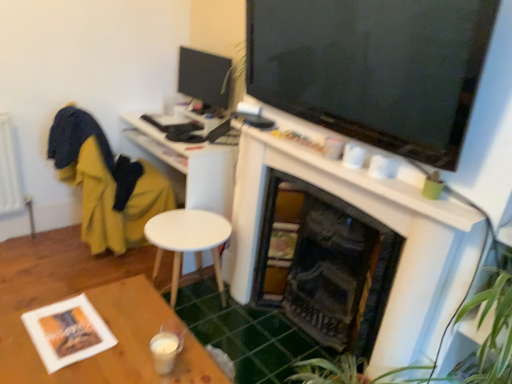
Question: Is wooden table at lower left thinner than white matte fireplace at upper center?

Choices:
 (A) no
 (B) yes

Answer: (A)

Question: Is there a large distance between wooden table at lower left and white matte fireplace at upper center?

Choices:
 (A) yes
 (B) no

Answer: (B)

Question: Is wooden table at lower left facing away from white matte fireplace at upper center?

Choices:
 (A) yes
 (B) no

Answer: (B)

Question: Can you confirm if wooden table at lower left is wider than white matte fireplace at upper center?

Choices:
 (A) no
 (B) yes

Answer: (B)

Question: From the image's perspective, is wooden table at lower left over white matte fireplace at upper center?

Choices:
 (A) no
 (B) yes

Answer: (A)

Question: From a real-world perspective, is wooden table at lower left on top of white matte fireplace at upper center?

Choices:
 (A) no
 (B) yes

Answer: (A)

Question: Is white matte desk at center oriented towards matte black monitor at upper left?

Choices:
 (A) yes
 (B) no

Answer: (B)

Question: Is white matte desk at center turned away from matte black monitor at upper left?

Choices:
 (A) no
 (B) yes

Answer: (A)

Question: Considering the relative sizes of white matte desk at center and matte black monitor at upper left in the image provided, is white matte desk at center smaller than matte black monitor at upper left?

Choices:
 (A) yes
 (B) no

Answer: (B)

Question: From a real-world perspective, does white matte desk at center sit lower than matte black monitor at upper left?

Choices:
 (A) no
 (B) yes

Answer: (B)

Question: Is the position of white matte desk at center less distant than that of matte black monitor at upper left?

Choices:
 (A) no
 (B) yes

Answer: (B)

Question: Does white matte desk at center contain matte black monitor at upper left?

Choices:
 (A) no
 (B) yes

Answer: (A)

Question: Does wooden table at lower left have a greater height compared to yellow fabric swivel chair at left?

Choices:
 (A) yes
 (B) no

Answer: (B)